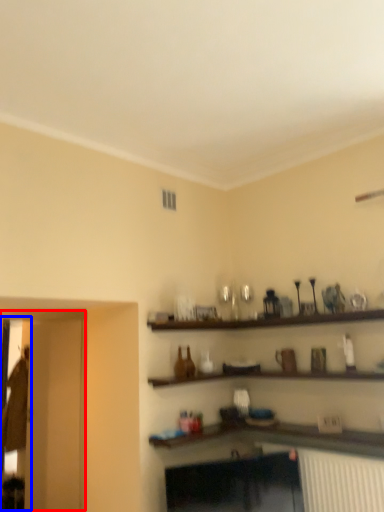
Question: Which of the following is the farthest to the observer, glass door (highlighted by a red box) or glass door (highlighted by a blue box)?

Choices:
 (A) glass door
 (B) glass door

Answer: (B)